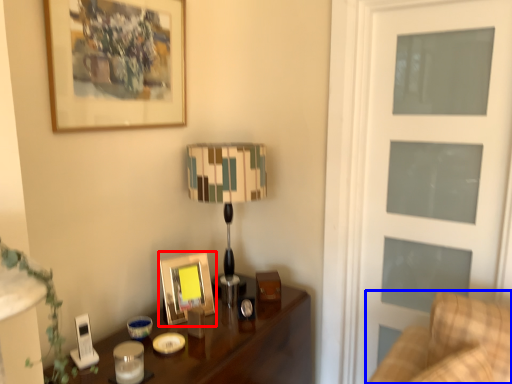
Question: Which object appears closest to the camera in this image, picture frame (highlighted by a red box) or furniture (highlighted by a blue box)?

Choices:
 (A) picture frame
 (B) furniture

Answer: (B)